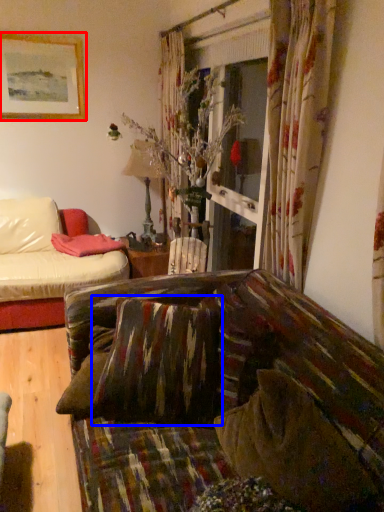
Question: Among these objects, which one is nearest to the camera, picture frame (highlighted by a red box) or pillow (highlighted by a blue box)?

Choices:
 (A) picture frame
 (B) pillow

Answer: (B)